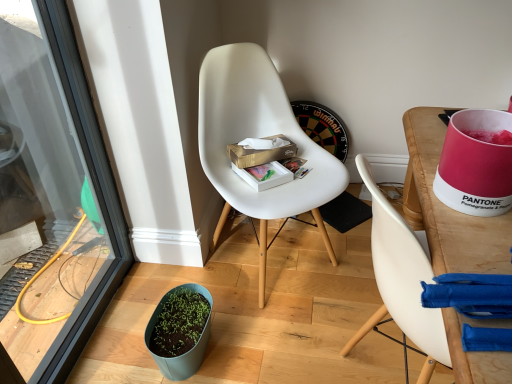
Question: From a real-world perspective, is green matte flowerpot at lower left on top of wooden desk at right?

Choices:
 (A) yes
 (B) no

Answer: (B)

Question: Can you confirm if green matte flowerpot at lower left is bigger than wooden desk at right?

Choices:
 (A) yes
 (B) no

Answer: (B)

Question: Would you consider green matte flowerpot at lower left to be distant from wooden desk at right?

Choices:
 (A) no
 (B) yes

Answer: (A)

Question: Can you confirm if green matte flowerpot at lower left is smaller than wooden desk at right?

Choices:
 (A) no
 (B) yes

Answer: (B)

Question: From a real-world perspective, is green matte flowerpot at lower left under wooden desk at right?

Choices:
 (A) no
 (B) yes

Answer: (B)

Question: From a real-world perspective, is green matte flowerpot at lower left above or below gold cardboard tissue box at center, the second box from the bottom?

Choices:
 (A) below
 (B) above

Answer: (A)

Question: Is point (197, 357) closer or farther from the camera than point (291, 150)?

Choices:
 (A) farther
 (B) closer

Answer: (B)

Question: In terms of width, does green matte flowerpot at lower left look wider or thinner when compared to gold cardboard tissue box at center, the second box from the bottom?

Choices:
 (A) wide
 (B) thin

Answer: (A)

Question: From the image's perspective, is green matte flowerpot at lower left located above or below gold cardboard tissue box at center, the second box from the bottom?

Choices:
 (A) above
 (B) below

Answer: (B)

Question: Is wooden desk at right situated inside white matte box at center, which appears as the second box when viewed from the top, or outside?

Choices:
 (A) outside
 (B) inside

Answer: (A)

Question: Considering the positions of wooden desk at right and white matte box at center, placed as the 1th box when sorted from bottom to top, in the image, is wooden desk at right taller or shorter than white matte box at center, placed as the 1th box when sorted from bottom to top,?

Choices:
 (A) tall
 (B) short

Answer: (A)

Question: Based on their positions, is wooden desk at right located to the left or right of white matte box at center, which appears as the second box when viewed from the top?

Choices:
 (A) left
 (B) right

Answer: (B)

Question: From a real-world perspective, is wooden desk at right above or below white matte box at center, which appears as the second box when viewed from the top?

Choices:
 (A) below
 (B) above

Answer: (A)

Question: Considering the positions of wooden desk at right and transparent glass screen door at lower left in the image, is wooden desk at right bigger or smaller than transparent glass screen door at lower left?

Choices:
 (A) big
 (B) small

Answer: (A)

Question: In terms of height, does wooden desk at right look taller or shorter compared to transparent glass screen door at lower left?

Choices:
 (A) short
 (B) tall

Answer: (A)